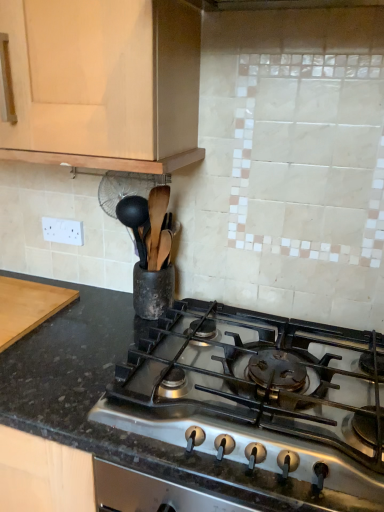
Where is `empty space that is ontop of wooden cutting board at left (from a real-world perspective)`? This screenshot has width=384, height=512. empty space that is ontop of wooden cutting board at left (from a real-world perspective) is located at coordinates (22, 298).